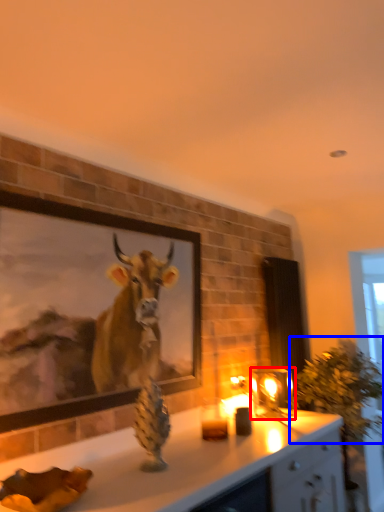
Question: Which point is further to the camera, candle holder (highlighted by a red box) or plant (highlighted by a blue box)?

Choices:
 (A) candle holder
 (B) plant

Answer: (A)